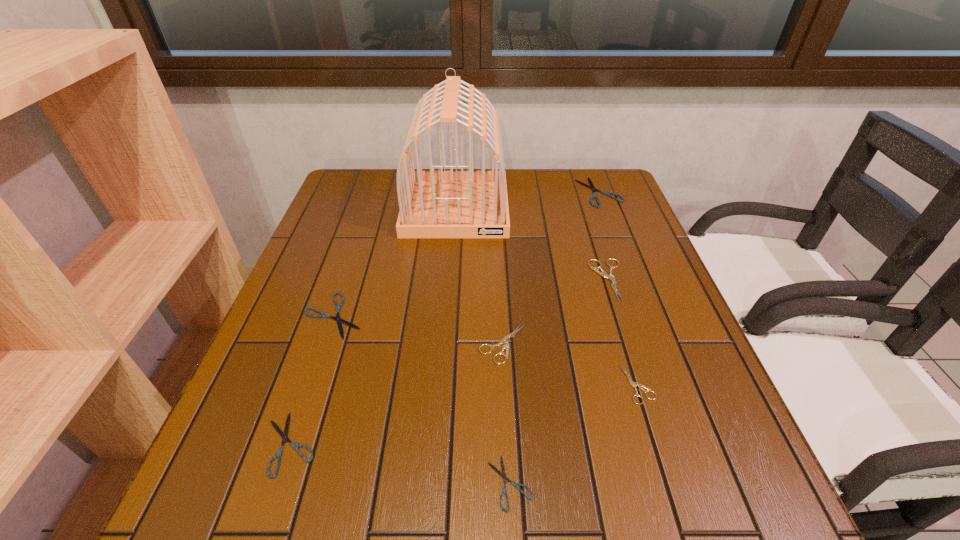
Locate an element on the screen. unoccupied position between the third nearest black shears and the smallest black shears is located at coordinates (x=421, y=399).

Identify which object is the closest to the second biggest black shears. Please provide its 2D coordinates. Your answer should be formatted as a tuple, i.e. [(x, y)], where the tuple contains the x and y coordinates of a point satisfying the conditions above.

[(284, 435)]

Point out which object is positioned as the seventh nearest to the third nearest shears. Please provide its 2D coordinates. Your answer should be formatted as a tuple, i.e. [(x, y)], where the tuple contains the x and y coordinates of a point satisfying the conditions above.

[(591, 186)]

Identify the location of the sixth closest shears to the rightmost black shears. This screenshot has width=960, height=540. (x=284, y=435).

Identify which shears is the fifth nearest to the shortest object. Please provide its 2D coordinates. Your answer should be formatted as a tuple, i.e. [(x, y)], where the tuple contains the x and y coordinates of a point satisfying the conditions above.

[(595, 269)]

Point out which beige shears is positioned as the nearest to the farthest beige shears. Please provide its 2D coordinates. Your answer should be formatted as a tuple, i.e. [(x, y)], where the tuple contains the x and y coordinates of a point satisfying the conditions above.

[(632, 383)]

The width and height of the screenshot is (960, 540). In order to click on beige shears identified as the second closest to the second biggest black shears in this screenshot , I will do `click(595, 269)`.

Identify which black shears is located as the nearest to the shortest object. Please provide its 2D coordinates. Your answer should be formatted as a tuple, i.e. [(x, y)], where the tuple contains the x and y coordinates of a point satisfying the conditions above.

[(284, 435)]

This screenshot has width=960, height=540. I want to click on black shears identified as the second closest to the second farthest black shears, so click(503, 474).

This screenshot has width=960, height=540. What are the coordinates of `free spot that satisfies the following two spatial constraints: 1. on the back side of the third nearest black shears; 2. on the right side of the biggest black shears` in the screenshot? It's located at (375, 192).